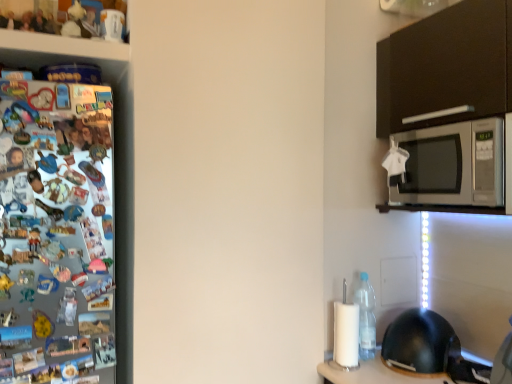
Identify the location of silver metallic microwave at upper right. coord(452,165).

What do you see at coordinates (366, 317) in the screenshot? I see `clear plastic bottle at lower right` at bounding box center [366, 317].

The height and width of the screenshot is (384, 512). Describe the element at coordinates (420, 343) in the screenshot. I see `black matte helmet at lower right` at that location.

The width and height of the screenshot is (512, 384). Find the location of `silver metallic microwave at upper right`. silver metallic microwave at upper right is located at coordinates (452, 165).

Could you tell me if clear plastic bottle at lower right is facing silver metallic microwave at upper right?

No, clear plastic bottle at lower right is not facing towards silver metallic microwave at upper right.

Considering the relative positions of clear plastic bottle at lower right and silver metallic microwave at upper right in the image provided, is clear plastic bottle at lower right in front of silver metallic microwave at upper right?

No, it is not.

Is clear plastic bottle at lower right wider or thinner than silver metallic microwave at upper right?

In the image, clear plastic bottle at lower right appears to be more narrow than silver metallic microwave at upper right.

Considering the positions of objects silver metallic microwave at upper right and black matte helmet at lower right in the image provided, who is more to the right, silver metallic microwave at upper right or black matte helmet at lower right?

silver metallic microwave at upper right is more to the right.

Which object is closer to the camera, silver metallic microwave at upper right or black matte helmet at lower right?

silver metallic microwave at upper right.

This screenshot has height=384, width=512. I want to click on helmet on the left of silver metallic microwave at upper right, so click(420, 343).

Considering the sizes of objects silver metallic microwave at upper right and black matte helmet at lower right in the image provided, who is bigger, silver metallic microwave at upper right or black matte helmet at lower right?

silver metallic microwave at upper right is bigger.

From the image's perspective, would you say silver metallic microwave at upper right is shown under clear plastic bottle at lower right?

Incorrect, from the image's perspective, silver metallic microwave at upper right is higher than clear plastic bottle at lower right.

Is point (452, 178) positioned before point (360, 288)?

No, it is behind (360, 288).

Which of these two, silver metallic microwave at upper right or clear plastic bottle at lower right, is bigger?

silver metallic microwave at upper right.

In terms of width, does black matte helmet at lower right look wider or thinner when compared to clear plastic bottle at lower right?

In the image, black matte helmet at lower right appears to be wider than clear plastic bottle at lower right.

From the image's perspective, is black matte helmet at lower right on clear plastic bottle at lower right?

No, from the image's perspective, black matte helmet at lower right is not on top of clear plastic bottle at lower right.

Can clear plastic bottle at lower right be found inside black matte helmet at lower right?

No, black matte helmet at lower right does not contain clear plastic bottle at lower right.

Who is taller, black matte helmet at lower right or clear plastic bottle at lower right?

With more height is clear plastic bottle at lower right.

Considering the sizes of black matte helmet at lower right and silver metallic microwave at upper right in the image, is black matte helmet at lower right taller or shorter than silver metallic microwave at upper right?

In the image, black matte helmet at lower right appears to be shorter than silver metallic microwave at upper right.

Consider the image. Considering the sizes of objects black matte helmet at lower right and silver metallic microwave at upper right in the image provided, who is thinner, black matte helmet at lower right or silver metallic microwave at upper right?

black matte helmet at lower right.

I want to click on helmet to the left of silver metallic microwave at upper right, so click(x=420, y=343).

In terms of width, does clear plastic bottle at lower right look wider or thinner when compared to black matte helmet at lower right?

clear plastic bottle at lower right is thinner than black matte helmet at lower right.

In terms of height, does clear plastic bottle at lower right look taller or shorter compared to black matte helmet at lower right?

clear plastic bottle at lower right is taller than black matte helmet at lower right.

Is clear plastic bottle at lower right facing towards black matte helmet at lower right?

Yes, clear plastic bottle at lower right is aimed at black matte helmet at lower right.

Are clear plastic bottle at lower right and black matte helmet at lower right beside each other?

No, clear plastic bottle at lower right is not in contact with black matte helmet at lower right.

This screenshot has height=384, width=512. I want to click on microwave oven on the right of clear plastic bottle at lower right, so click(452, 165).

Where is `helmet to the left of silver metallic microwave at upper right`? The width and height of the screenshot is (512, 384). helmet to the left of silver metallic microwave at upper right is located at coordinates (420, 343).

Based on their spatial positions, is black matte helmet at lower right or silver metallic microwave at upper right further from clear plastic bottle at lower right?

The object further to clear plastic bottle at lower right is silver metallic microwave at upper right.

Considering their positions, is clear plastic bottle at lower right positioned further to black matte helmet at lower right than silver metallic microwave at upper right?

The object further to black matte helmet at lower right is silver metallic microwave at upper right.

Based on their spatial positions, is silver metallic microwave at upper right or clear plastic bottle at lower right further from black matte helmet at lower right?

silver metallic microwave at upper right is positioned further to the anchor black matte helmet at lower right.

Based on their spatial positions, is clear plastic bottle at lower right or black matte helmet at lower right closer to silver metallic microwave at upper right?

clear plastic bottle at lower right is positioned closer to the anchor silver metallic microwave at upper right.

Which object lies nearer to the anchor point silver metallic microwave at upper right, black matte helmet at lower right or clear plastic bottle at lower right?

Based on the image, clear plastic bottle at lower right appears to be nearer to silver metallic microwave at upper right.

Considering their positions, is silver metallic microwave at upper right positioned closer to clear plastic bottle at lower right than black matte helmet at lower right?

Based on the image, black matte helmet at lower right appears to be nearer to clear plastic bottle at lower right.

Identify the location of bottle between silver metallic microwave at upper right and black matte helmet at lower right vertically. (366, 317).